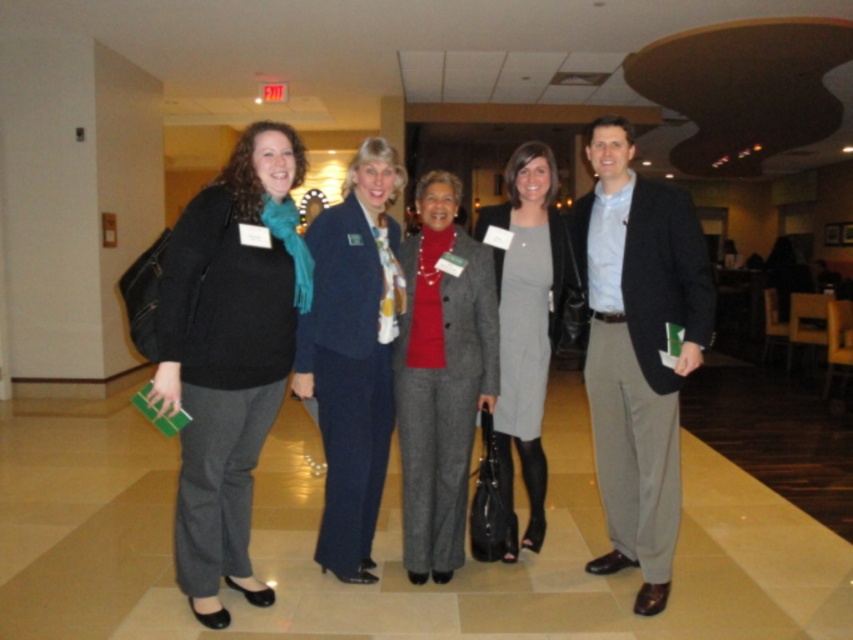
In the scene described, there are two individuals dressed in professional attire. One is wearing a matte black blazer at right and the other a gray wool suit at center. Which of these two outfits appears to be larger in size?

The matte black blazer at right is bigger than the gray wool suit at center.

You are a photographer setting up for a group photo. You need to position the matte black jacket at left and the navy blue suit at center so that there is at least 30 centimeters between them for proper framing. Based on the current distance, can you confirm if they are already spaced appropriately?

The matte black jacket at left is currently 32.27 centimeters from the navy blue suit at center, which exceeds the required 30 centimeters. Therefore, they are already spaced appropriately for proper framing.

You are organizing a photo shoot and need to arrange two outfits from the image for a catalog. The outfits are the matte black blazer at right and the gray wool suit at center. According to the image, which outfit is positioned to the right of the other?

The matte black blazer at right is positioned on the right side of the gray wool suit at center, so it is to the right of the gray wool suit at center.